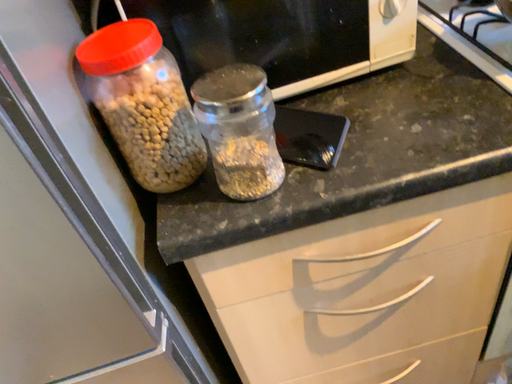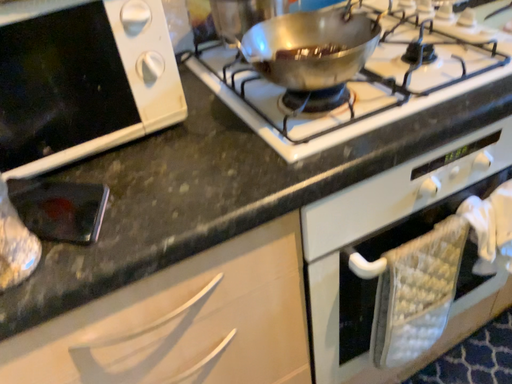
Question: How did the camera likely rotate when shooting the video?

Choices:
 (A) rotated upward
 (B) rotated downward

Answer: (A)